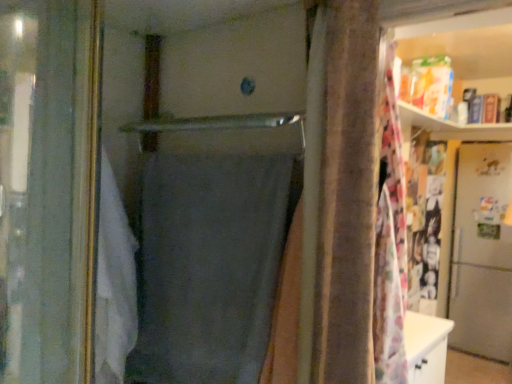
What do you see at coordinates (482, 252) in the screenshot? I see `metallic silver refrigerator at right` at bounding box center [482, 252].

Where is `metallic silver refrigerator at right`? This screenshot has height=384, width=512. metallic silver refrigerator at right is located at coordinates (482, 252).

Describe the element at coordinates (209, 264) in the screenshot. I see `gray matte fabric at center` at that location.

This screenshot has width=512, height=384. In order to click on gray matte fabric at center in this screenshot , I will do `click(209, 264)`.

Where is `metallic silver refrigerator at right`? metallic silver refrigerator at right is located at coordinates (482, 252).

Considering the positions of objects metallic silver refrigerator at right and gray matte fabric at center in the image provided, who is more to the left, metallic silver refrigerator at right or gray matte fabric at center?

Positioned to the left is gray matte fabric at center.

In the scene shown: Is the position of metallic silver refrigerator at right less distant than that of gray matte fabric at center?

No, metallic silver refrigerator at right is further to the viewer.

Considering the points (507, 157) and (246, 327), which point is behind, point (507, 157) or point (246, 327)?

Positioned behind is point (507, 157).

From the image's perspective, is metallic silver refrigerator at right on gray matte fabric at center?

No.

From a real-world perspective, is metallic silver refrigerator at right above or below gray matte fabric at center?

metallic silver refrigerator at right is below gray matte fabric at center.

Between metallic silver refrigerator at right and gray matte fabric at center, which one has smaller width?

Thinner between the two is gray matte fabric at center.

Can you confirm if metallic silver refrigerator at right is taller than gray matte fabric at center?

Indeed, metallic silver refrigerator at right has a greater height compared to gray matte fabric at center.

Does metallic silver refrigerator at right have a larger size compared to gray matte fabric at center?

Yes.

Could gray matte fabric at center be considered to be inside metallic silver refrigerator at right?

No, gray matte fabric at center is located outside of metallic silver refrigerator at right.

Is metallic silver refrigerator at right not close to gray matte fabric at center?

Yes.

Is gray matte fabric at center at the back of metallic silver refrigerator at right?

No, metallic silver refrigerator at right is not facing away from gray matte fabric at center.

In the scene shown: How different are the orientations of metallic silver refrigerator at right and gray matte fabric at center in degrees?

The angle between the facing direction of metallic silver refrigerator at right and the facing direction of gray matte fabric at center is 85.6 degrees.

Find the location of a particular element. The width and height of the screenshot is (512, 384). shower curtain that appears above the metallic silver refrigerator at right (from the image's perspective) is located at coordinates point(209,264).

From the picture: Is gray matte fabric at center to the right of metallic silver refrigerator at right from the viewer's perspective?

Incorrect, gray matte fabric at center is not on the right side of metallic silver refrigerator at right.

Is gray matte fabric at center in front of or behind metallic silver refrigerator at right in the image?

Clearly, gray matte fabric at center is in front of metallic silver refrigerator at right.

Considering the points (142, 225) and (484, 277), which point is behind, point (142, 225) or point (484, 277)?

The point (484, 277) is farther from the camera.

From the image's perspective, is gray matte fabric at center located above metallic silver refrigerator at right?

Yes, from the image's perspective, gray matte fabric at center is on top of metallic silver refrigerator at right.

From a real-world perspective, which object rests below the other?

metallic silver refrigerator at right.

Looking at this image, between gray matte fabric at center and metallic silver refrigerator at right, which one has smaller width?

Thinner between the two is gray matte fabric at center.

Who is shorter, gray matte fabric at center or metallic silver refrigerator at right?

gray matte fabric at center is shorter.

Between gray matte fabric at center and metallic silver refrigerator at right, which one has larger size?

With larger size is metallic silver refrigerator at right.

Would you say gray matte fabric at center is outside metallic silver refrigerator at right?

gray matte fabric at center lies outside metallic silver refrigerator at right's area.

Would you consider gray matte fabric at center to be distant from metallic silver refrigerator at right?

Yes, gray matte fabric at center and metallic silver refrigerator at right are located far from each other.

Consider the image. Is gray matte fabric at center facing away from metallic silver refrigerator at right?

Yes, gray matte fabric at center is positioned with its back facing metallic silver refrigerator at right.

What's the angular difference between gray matte fabric at center and metallic silver refrigerator at right's facing directions?

They differ by 85.6 degrees in their facing directions.

How much distance is there between gray matte fabric at center and metallic silver refrigerator at right?

gray matte fabric at center is 3.60 meters from metallic silver refrigerator at right.

I want to click on shower curtain on the left of metallic silver refrigerator at right, so click(209, 264).

At what (x,y) coordinates should I click in order to perform the action: click on shower curtain that is above the metallic silver refrigerator at right (from a real-world perspective). Please return your answer as a coordinate pair (x, y). Looking at the image, I should click on (209, 264).

Identify the location of screen door to the right of gray matte fabric at center. The height and width of the screenshot is (384, 512). (482, 252).